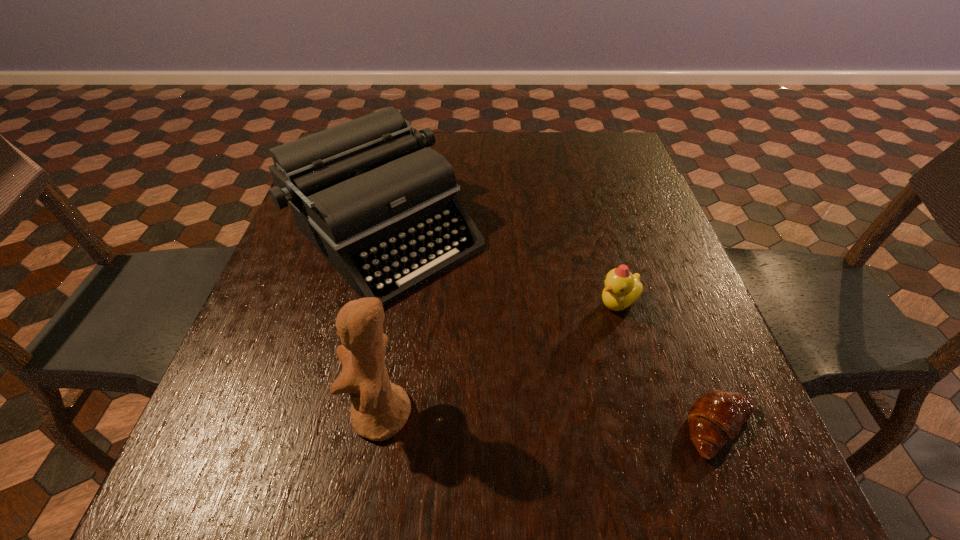
This screenshot has width=960, height=540. What are the coordinates of `free space that satisfies the following two spatial constraints: 1. on the front side of the shortest object; 2. on the right side of the third tallest object` in the screenshot? It's located at (654, 429).

The width and height of the screenshot is (960, 540). Find the location of `vacant space that satisfies the following two spatial constraints: 1. on the front side of the second tallest object; 2. on the left side of the crescent roll`. vacant space that satisfies the following two spatial constraints: 1. on the front side of the second tallest object; 2. on the left side of the crescent roll is located at coordinates (345, 429).